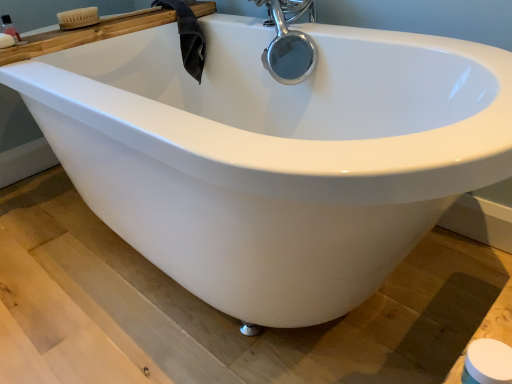
You are a GUI agent. You are given a task and a screenshot of the screen. Output one action in this format:
    pyautogui.click(x=<x>, y=<y>)
    Task: Click on the woodenbrush at upper left
    Image resolution: width=512 pixels, height=384 pixels.
    Given the screenshot: What is the action you would take?
    pyautogui.click(x=84, y=35)

Find the location of `white matte toilet paper at lower right`. white matte toilet paper at lower right is located at coordinates [487, 363].

Identify the location of translucent plastic bottle at upper left. The width and height of the screenshot is (512, 384). (10, 28).

Consider the image. Considering the relative positions of woodenbrush at upper left and translucent plastic bottle at upper left in the image provided, is woodenbrush at upper left to the right of translucent plastic bottle at upper left from the viewer's perspective?

Yes, woodenbrush at upper left is to the right of translucent plastic bottle at upper left.

Between woodenbrush at upper left and translucent plastic bottle at upper left, which one has less height?

woodenbrush at upper left.

Is translucent plastic bottle at upper left completely or partially inside woodenbrush at upper left?

That's incorrect, translucent plastic bottle at upper left is not inside woodenbrush at upper left.

Find the location of a particular element. ledge in front of the translucent plastic bottle at upper left is located at coordinates (84, 35).

Between white matte soap at upper left and white matte toilet paper at lower right, which one appears on the left side from the viewer's perspective?

white matte soap at upper left.

In the scene shown: From a real-world perspective, is white matte soap at upper left located beneath white matte toilet paper at lower right?

Incorrect, from a real-world perspective, white matte soap at upper left is higher than white matte toilet paper at lower right.

Is white matte soap at upper left touching white matte toilet paper at lower right?

No, white matte soap at upper left is not next to white matte toilet paper at lower right.

Looking at this image, does white matte soap at upper left have a lesser height compared to white matte toilet paper at lower right?

Yes.

Which of these two, white matte toilet paper at lower right or white matte soap at upper left, is bigger?

With larger size is white matte toilet paper at lower right.

I want to click on soap located above the white matte toilet paper at lower right (from a real-world perspective), so click(x=6, y=41).

Does point (492, 381) come in front of point (2, 36)?

Yes, it is.

From the picture: From the image's perspective, is white matte toilet paper at lower right on white matte soap at upper left?

Incorrect, from the image's perspective, white matte toilet paper at lower right is lower than white matte soap at upper left.

Is white matte soap at upper left facing towards translucent plastic bottle at upper left?

No, white matte soap at upper left does not turn towards translucent plastic bottle at upper left.

Is point (5, 41) behind point (2, 24)?

That is False.

Considering the sizes of objects white matte soap at upper left and translucent plastic bottle at upper left in the image provided, who is smaller, white matte soap at upper left or translucent plastic bottle at upper left?

Smaller between the two is translucent plastic bottle at upper left.

Who is shorter, white matte soap at upper left or translucent plastic bottle at upper left?

white matte soap at upper left is shorter.

Who is taller, woodenbrush at upper left or white matte soap at upper left?

Standing taller between the two is woodenbrush at upper left.

Is point (21, 53) positioned after point (13, 42)?

No.

Is woodenbrush at upper left positioned beyond the bounds of white matte soap at upper left?

woodenbrush at upper left is positioned outside white matte soap at upper left.

Are woodenbrush at upper left and white matte soap at upper left making contact?

No, woodenbrush at upper left is not next to white matte soap at upper left.

Is white matte soap at upper left far from woodenbrush at upper left?

white matte soap at upper left is actually quite close to woodenbrush at upper left.

From a real-world perspective, does white matte soap at upper left stand above woodenbrush at upper left?

Yes, from a real-world perspective, white matte soap at upper left is above woodenbrush at upper left.

From the image's perspective, which one is positioned higher, white matte soap at upper left or woodenbrush at upper left?

woodenbrush at upper left appears higher in the image.

From the picture: Considering the relative sizes of white matte toilet paper at lower right and woodenbrush at upper left in the image provided, is white matte toilet paper at lower right taller than woodenbrush at upper left?

In fact, white matte toilet paper at lower right may be shorter than woodenbrush at upper left.

From the picture: How different are the orientations of white matte toilet paper at lower right and woodenbrush at upper left in degrees?

There is a 0.882-degree angle between the facing directions of white matte toilet paper at lower right and woodenbrush at upper left.

Looking at this image, is there a large distance between white matte toilet paper at lower right and woodenbrush at upper left?

Absolutely, white matte toilet paper at lower right is distant from woodenbrush at upper left.

The width and height of the screenshot is (512, 384). I want to click on toiletry below the woodenbrush at upper left (from the image's perspective), so click(10, 28).

Find the location of a particular element. toilet paper on the right of white matte soap at upper left is located at coordinates (487, 363).

From the image, which object appears to be nearer to white matte soap at upper left, translucent plastic bottle at upper left or woodenbrush at upper left?

Based on the image, translucent plastic bottle at upper left appears to be nearer to white matte soap at upper left.

Looking at the image, which one is located further to white matte toilet paper at lower right, woodenbrush at upper left or white matte soap at upper left?

Based on the image, white matte soap at upper left appears to be further to white matte toilet paper at lower right.

Looking at the image, which one is located closer to white matte toilet paper at lower right, white matte soap at upper left or translucent plastic bottle at upper left?

white matte soap at upper left is closer to white matte toilet paper at lower right.

Based on the photo, from the image, which object appears to be nearer to white matte soap at upper left, translucent plastic bottle at upper left or white matte toilet paper at lower right?

translucent plastic bottle at upper left lies closer to white matte soap at upper left than the other object.

Considering their positions, is woodenbrush at upper left positioned closer to translucent plastic bottle at upper left than white matte toilet paper at lower right?

woodenbrush at upper left is closer to translucent plastic bottle at upper left.

When comparing their distances from translucent plastic bottle at upper left, does woodenbrush at upper left or white matte soap at upper left seem further?

Among the two, woodenbrush at upper left is located further to translucent plastic bottle at upper left.

Based on their spatial positions, is white matte toilet paper at lower right or white matte soap at upper left further from translucent plastic bottle at upper left?

white matte toilet paper at lower right is further to translucent plastic bottle at upper left.

Based on their spatial positions, is translucent plastic bottle at upper left or white matte soap at upper left closer to woodenbrush at upper left?

Among the two, white matte soap at upper left is located nearer to woodenbrush at upper left.

Locate an element on the screen. The width and height of the screenshot is (512, 384). ledge situated between white matte soap at upper left and white matte toilet paper at lower right from left to right is located at coordinates (84, 35).

Locate an element on the screen. soap between translucent plastic bottle at upper left and white matte toilet paper at lower right in the horizontal direction is located at coordinates (6, 41).

I want to click on soap located between translucent plastic bottle at upper left and woodenbrush at upper left in the left-right direction, so click(6, 41).

Locate an element on the screen. This screenshot has height=384, width=512. ledge between translucent plastic bottle at upper left and white matte toilet paper at lower right from left to right is located at coordinates (84, 35).